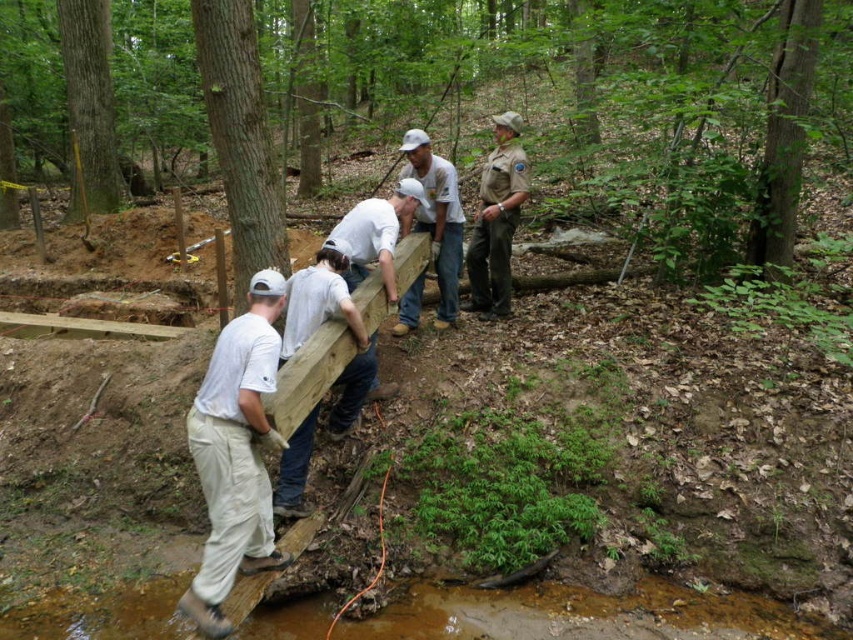
Question: Which point is farther to the camera?

Choices:
 (A) (338, 429)
 (B) (462, 218)

Answer: (B)

Question: Estimate the real-world distances between objects in this image. Which object is closer to the brown uniform at center?

Choices:
 (A) white cotton shirt at left
 (B) white matte wood at center
 (C) white matte shirt at center
 (D) light brown uniform at center

Answer: (D)

Question: Does white matte wood at center appear under white matte shirt at center?

Choices:
 (A) yes
 (B) no

Answer: (A)

Question: Which object appears farthest from the camera in this image?

Choices:
 (A) brown uniform at center
 (B) white matte shirt at center
 (C) white matte wood at center
 (D) white cotton shirt at left

Answer: (A)

Question: Can you confirm if brown uniform at center is thinner than white matte shirt at center?

Choices:
 (A) no
 (B) yes

Answer: (B)

Question: Is white cotton shirt at left positioned in front of light brown uniform at center?

Choices:
 (A) yes
 (B) no

Answer: (A)